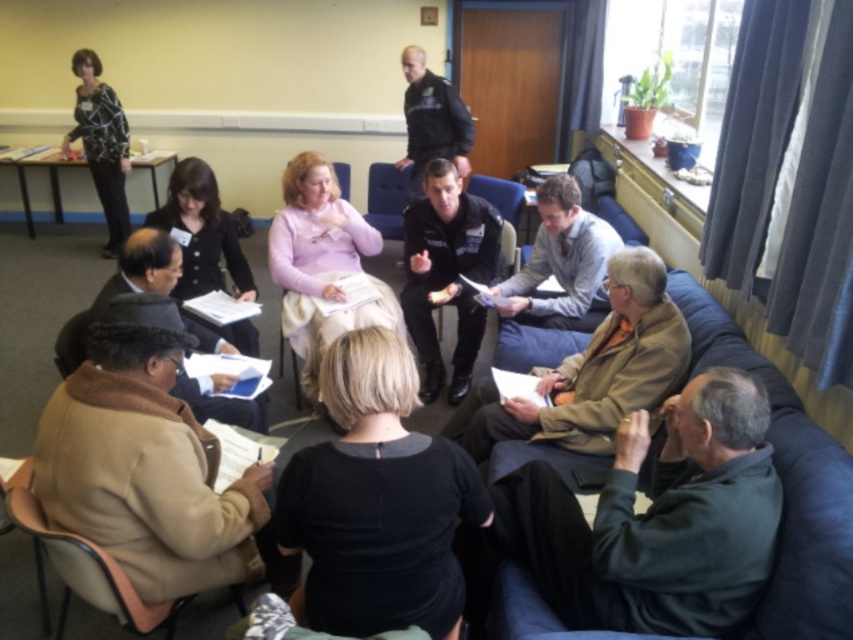
Between point (221, 557) and point (572, 195), which one is positioned behind?

Positioned behind is point (572, 195).

Is brown fuzzy coat at lower left taller than light gray shirt at center?

Yes.

You are a GUI agent. You are given a task and a screenshot of the screen. Output one action in this format:
    pyautogui.click(x=<x>, y=<y>)
    Task: Click on the brown fuzzy coat at lower left
    
    Given the screenshot: What is the action you would take?
    pyautogui.click(x=146, y=461)

The height and width of the screenshot is (640, 853). What are the coordinates of `brown fuzzy coat at lower left` in the screenshot? It's located at (146, 461).

Does dark blue uniform at center have a smaller size compared to tan leather chair at lower left?

Actually, dark blue uniform at center might be larger than tan leather chair at lower left.

Looking at this image, does dark blue uniform at center have a lesser width compared to tan leather chair at lower left?

Indeed, dark blue uniform at center has a lesser width compared to tan leather chair at lower left.

Is point (457, 333) in front of point (109, 604)?

No, (457, 333) is behind (109, 604).

This screenshot has height=640, width=853. In order to click on dark blue uniform at center in this screenshot , I will do `click(447, 273)`.

Which is more to the right, dark gray sweater at lower right or matte black chair at center?

From the viewer's perspective, dark gray sweater at lower right appears more on the right side.

Does dark gray sweater at lower right appear under matte black chair at center?

Yes, dark gray sweater at lower right is below matte black chair at center.

Is point (555, 486) closer to viewer compared to point (502, 269)?

Yes, it is in front of point (502, 269).

This screenshot has width=853, height=640. In order to click on dark gray sweater at lower right in this screenshot , I will do `click(659, 518)`.